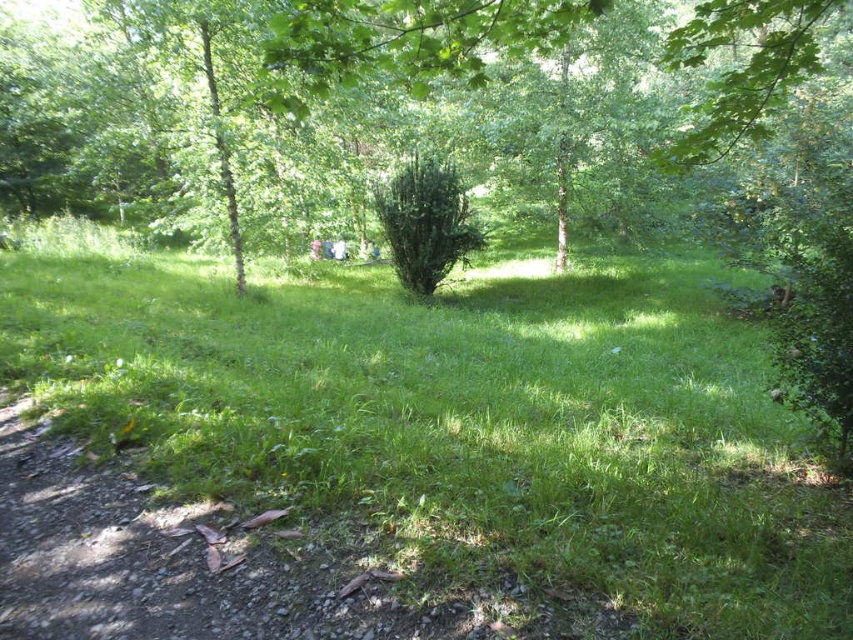
You are standing at the camera position and want to reach both the point at coordinates (672, 456) and the point at coordinates (398, 33). Which point will you reach first if you move directly towards them?

You will reach the point at coordinates (672, 456) first because it is closer to the camera than the point at coordinates (398, 33).

You are standing at the center of a grassy area in a park. You notice a point marked at coordinates [457,419]. What is the color of the area at that point?

The point at coordinates [457,419] marks green grassy at center, so the area there is green.